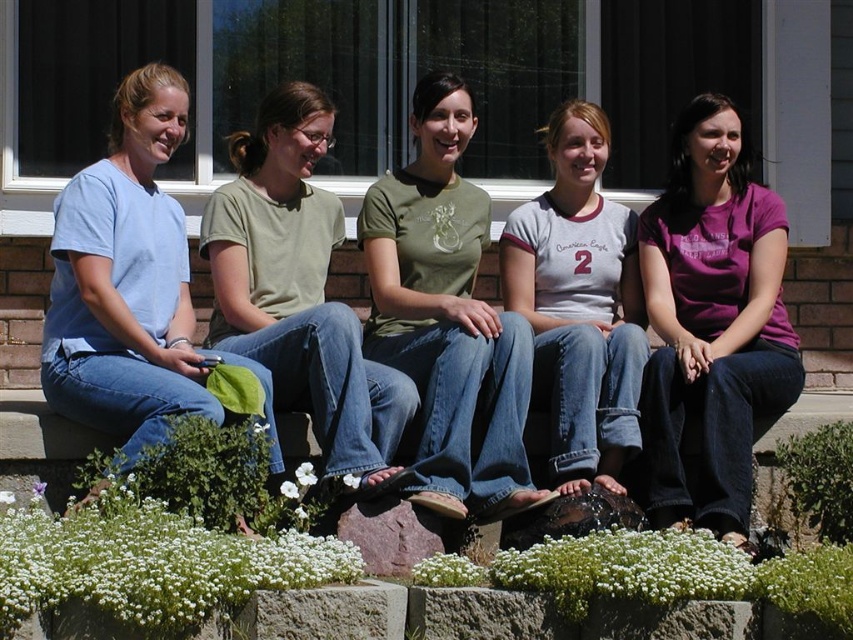
You are part of the group sitting on the steps and want to hand a note to the person wearing the purple cotton shirt at center. If you are sitting next to the green matte shirt at center, which direction should you pass the note?

The purple cotton shirt at center is to the right of the green matte shirt at center, so you should pass the note to your right.